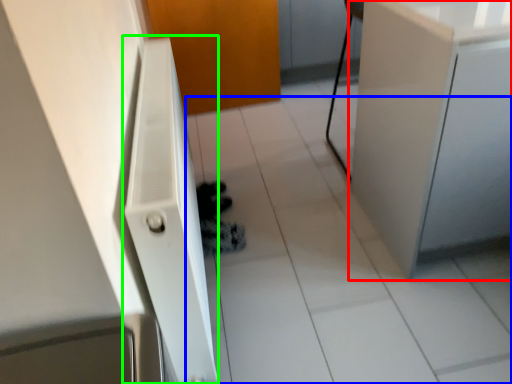
Question: Estimate the real-world distances between objects in this image. Which object is farther from cabinetry (highlighted by a red box), tile (highlighted by a blue box) or radiator (highlighted by a green box)?

Choices:
 (A) tile
 (B) radiator

Answer: (B)